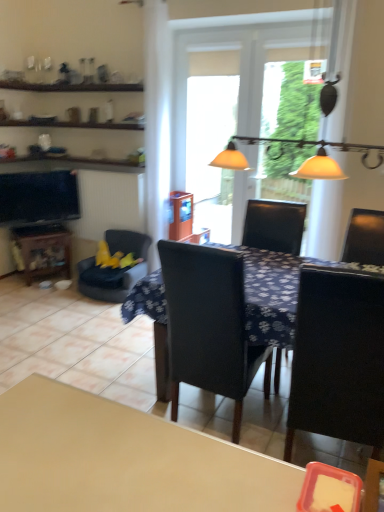
Question: From the image's perspective, is black leather chair at center, marked as the 2th chair in a back-to-front arrangement, positioned above or below matte glass light fixture at upper center?

Choices:
 (A) below
 (B) above

Answer: (A)

Question: Considering the positions of black leather chair at center, marked as the 2th chair in a back-to-front arrangement, and matte glass light fixture at upper center in the image, is black leather chair at center, marked as the 2th chair in a back-to-front arrangement, taller or shorter than matte glass light fixture at upper center?

Choices:
 (A) short
 (B) tall

Answer: (B)

Question: Which is nearer to the dark blue fabric table at center?

Choices:
 (A) matte glass light fixture at upper center
 (B) matte black tv at left
 (C) velvet yellow chair at left, positioned as the 3th chair in right-to-left order
 (D) black leather chair at right, placed as the first chair when sorted from right to left
 (E) black leather chair at center, marked as the 2th chair in a back-to-front arrangement

Answer: (E)

Question: Based on their relative distances, which object is farther from the translucent plastic screen door at center?

Choices:
 (A) velvet yellow chair at left, placed as the third chair when sorted from front to back
 (B) black leather chair at center, which appears as the second chair when viewed from the right
 (C) black leather chair at right, arranged as the first chair when viewed from the front
 (D) transparent glass window at center
 (E) matte black tv at left

Answer: (C)